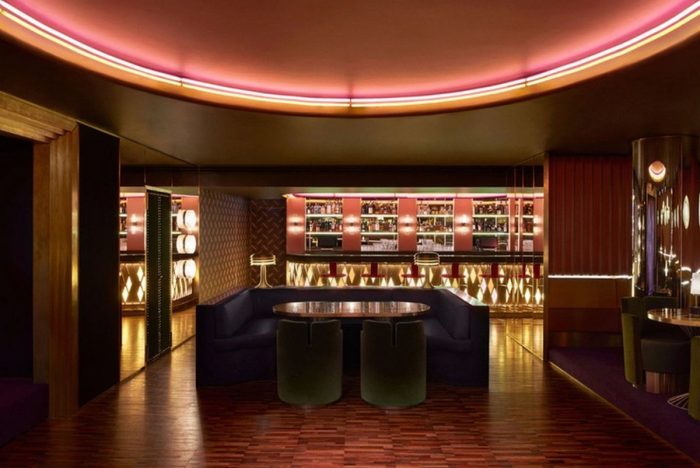
Where is `circular light`? Image resolution: width=700 pixels, height=468 pixels. circular light is located at coordinates (657, 175).